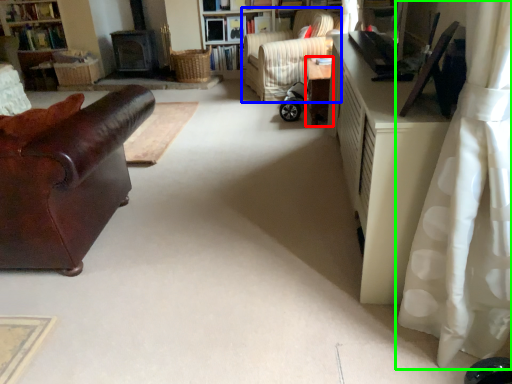
Question: Which is farther away from table (highlighted by a red box)? chair (highlighted by a blue box) or curtain (highlighted by a green box)?

Choices:
 (A) chair
 (B) curtain

Answer: (B)